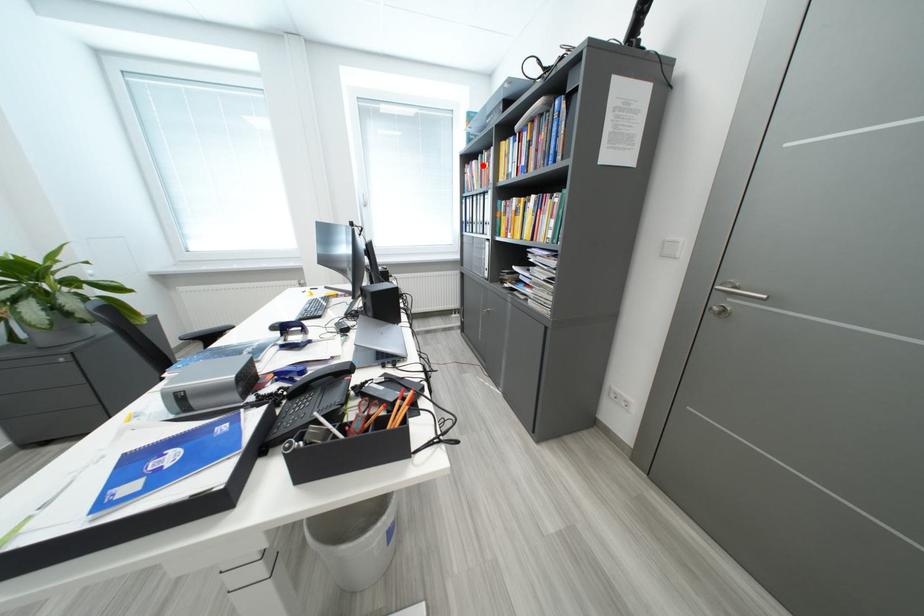
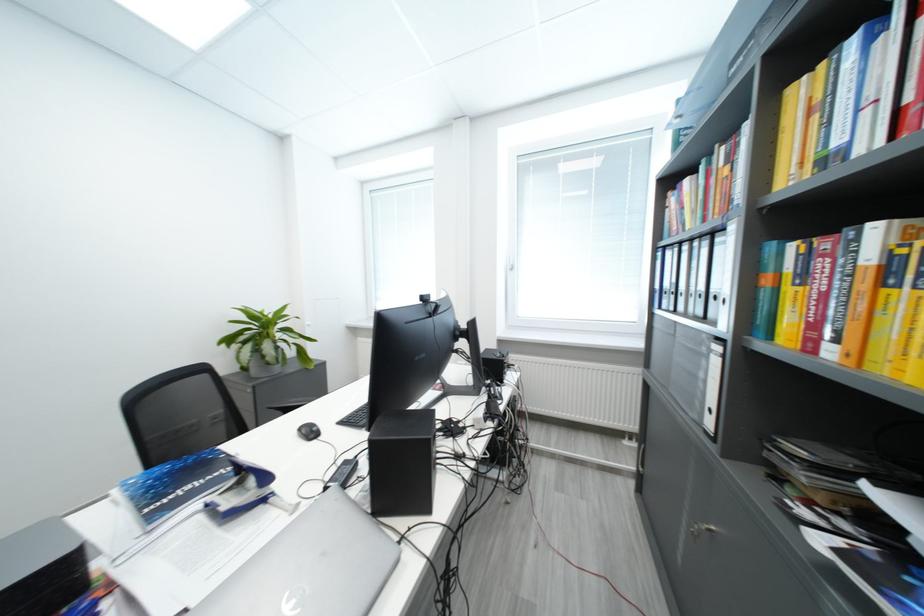
Question: I am providing you with two images of the same scene from different viewpoints. Image1 has a red point marked. In image2, the corresponding 3D location appears at what relative position? Reply with the corresponding letter.

Choices:
 (A) Closer
 (B) Farther

Answer: (B)